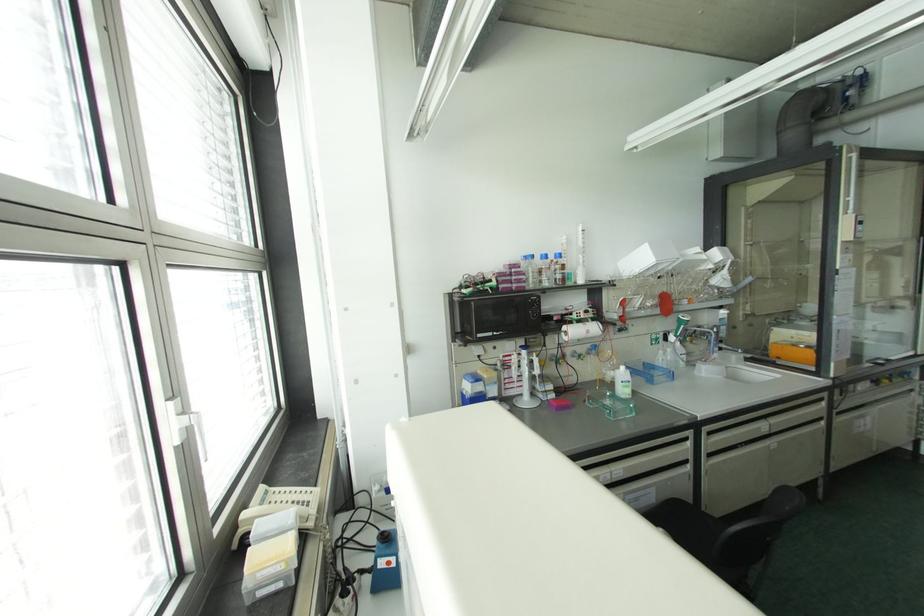
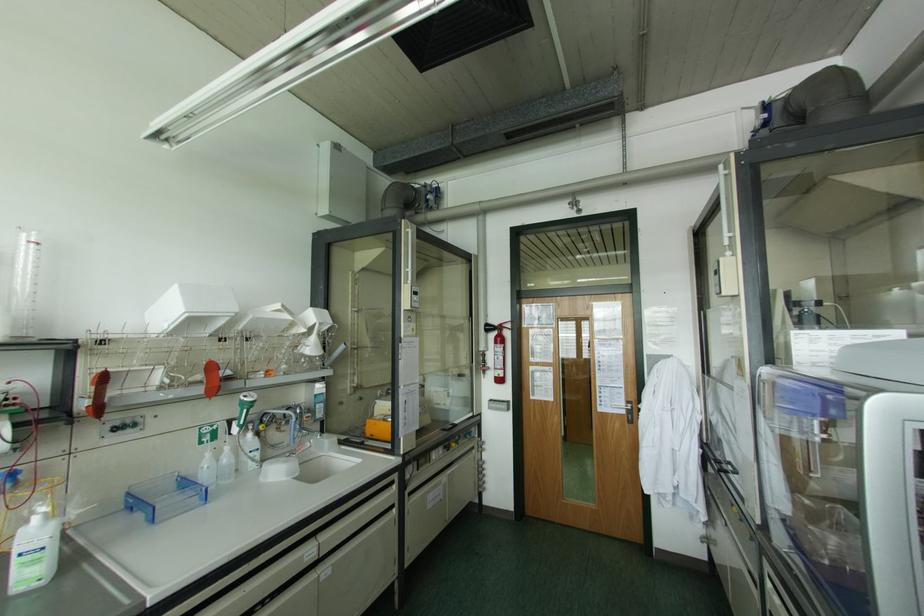
In the second image, find the point that corresponds to (x=660, y=352) in the first image.

(208, 454)